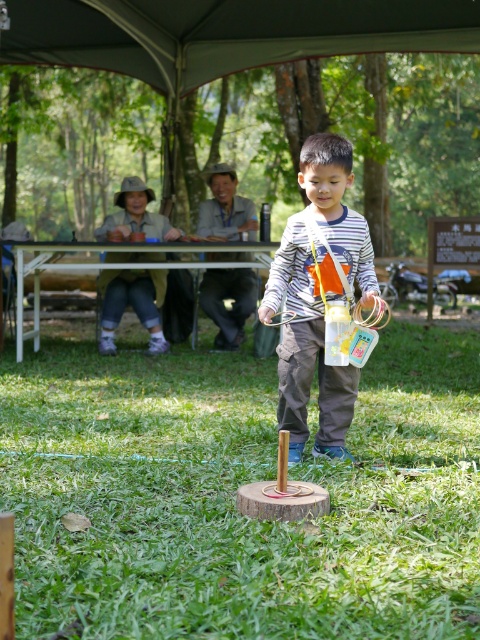
You are planning to set up a small garden between the dark gray fabric canopy at upper center and the white plastic picnic table at upper center. If the garden requires a space of 8 meters, will it fit between them?

The distance between the dark gray fabric canopy at upper center and the white plastic picnic table at upper center is 7.61 meters, which is less than the required 8 meters. Therefore, the garden will not fit between them.

You are planning to set up a small garden on the green grass at center. Considering the height of the white plastic picnic table at upper center, will the grass be visible once the garden is established?

The green grass at center is shorter than the white plastic picnic table at upper center. Once the garden is established, the grass will still be visible because its height is shorter than the table, but the exact visibility may depend on the garden plants chosen.

You are a drone operator trying to capture the best aerial shot of the green grass at center. Based on the coordinates provided, what are the X and Y coordinates you should aim for?

The X coordinate is 0.773 and the Y coordinate is 0.490.